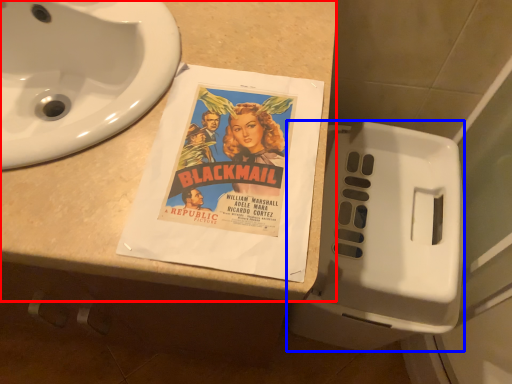
Question: Which object is further to the camera taking this photo, counter top (highlighted by a red box) or toilet (highlighted by a blue box)?

Choices:
 (A) counter top
 (B) toilet

Answer: (B)